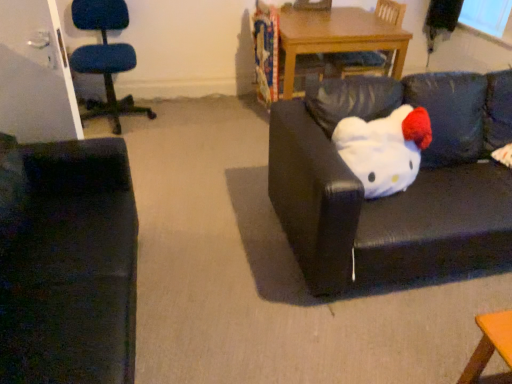
In order to face black leather couch at center, which ranks as the first studio couch in right-to-left order, should I rotate leftwards or rightwards?

You should rotate right by 24.786 degrees.

How much space does black leather couch at center, which ranks as the first studio couch in right-to-left order, occupy horizontally?

It is 33.76 inches.

What is the approximate width of white plush toy at right?

10.92 inches.

What do you see at coordinates (105, 57) in the screenshot? I see `blue fabric chair at left, positioned as the first chair in left-to-right order` at bounding box center [105, 57].

Image resolution: width=512 pixels, height=384 pixels. Find the location of `wooden chair at upper center, which appears as the second chair when viewed from the left`. wooden chair at upper center, which appears as the second chair when viewed from the left is located at coordinates 362,62.

In the image, is wooden chair at upper center, which appears as the second chair when viewed from the left, positioned in front of or behind wooden table at center?

wooden chair at upper center, which appears as the second chair when viewed from the left, is behind wooden table at center.

Is wooden chair at upper center, which appears as the second chair when viewed from the left, smaller than wooden table at center?

Correct, wooden chair at upper center, which appears as the second chair when viewed from the left, occupies less space than wooden table at center.

Is wooden chair at upper center, which appears as the second chair when viewed from the left, looking in the opposite direction of wooden table at center?

Yes, wooden chair at upper center, which appears as the second chair when viewed from the left, is facing away from wooden table at center.

Could you tell me if wooden chair at upper center, which appears as the second chair when viewed from the left, is turned towards blue fabric chair at left, arranged as the 2th chair when viewed from the right?

Yes, wooden chair at upper center, which appears as the second chair when viewed from the left, is facing blue fabric chair at left, arranged as the 2th chair when viewed from the right.

Is blue fabric chair at left, positioned as the first chair in left-to-right order, surrounded by wooden chair at upper center, the first chair from the right?

Actually, blue fabric chair at left, positioned as the first chair in left-to-right order, is outside wooden chair at upper center, the first chair from the right.

Are wooden chair at upper center, the first chair from the right, and blue fabric chair at left, arranged as the 2th chair when viewed from the right, located far from each other?

Yes, wooden chair at upper center, the first chair from the right, and blue fabric chair at left, arranged as the 2th chair when viewed from the right, are quite far apart.

Is wooden chair at upper center, the first chair from the right, taller or shorter than blue fabric chair at left, arranged as the 2th chair when viewed from the right?

wooden chair at upper center, the first chair from the right, is shorter than blue fabric chair at left, arranged as the 2th chair when viewed from the right.

Based on the photo, in terms of height, does wooden chair at upper center, which appears as the second chair when viewed from the left, look taller or shorter compared to white plush toy at right?

wooden chair at upper center, which appears as the second chair when viewed from the left, is taller than white plush toy at right.

This screenshot has width=512, height=384. Find the location of `toy above the wooden chair at upper center, which appears as the second chair when viewed from the left (from a real-world perspective)`. toy above the wooden chair at upper center, which appears as the second chair when viewed from the left (from a real-world perspective) is located at coordinates (384, 149).

Is wooden chair at upper center, which appears as the second chair when viewed from the left, oriented away from white plush toy at right?

No, wooden chair at upper center, which appears as the second chair when viewed from the left, is not facing away from white plush toy at right.

Which object is closer to the camera taking this photo, wooden chair at upper center, the first chair from the right, or white plush toy at right?

white plush toy at right is closer to the camera.

Looking at this image, is blue fabric chair at left, arranged as the 2th chair when viewed from the right, not inside black leather couch at center, arranged as the 2th studio couch when viewed from the left?

Indeed, blue fabric chair at left, arranged as the 2th chair when viewed from the right, is completely outside black leather couch at center, arranged as the 2th studio couch when viewed from the left.

Considering the sizes of objects blue fabric chair at left, arranged as the 2th chair when viewed from the right, and black leather couch at center, arranged as the 2th studio couch when viewed from the left, in the image provided, who is smaller, blue fabric chair at left, arranged as the 2th chair when viewed from the right, or black leather couch at center, arranged as the 2th studio couch when viewed from the left,?

With smaller size is blue fabric chair at left, arranged as the 2th chair when viewed from the right.

Is blue fabric chair at left, arranged as the 2th chair when viewed from the right, far away from black leather couch at center, arranged as the 2th studio couch when viewed from the left?

Yes, blue fabric chair at left, arranged as the 2th chair when viewed from the right, is far from black leather couch at center, arranged as the 2th studio couch when viewed from the left.

Is point (429, 144) farther from viewer compared to point (344, 286)?

Yes, point (429, 144) is behind point (344, 286).

Considering the positions of objects white plush toy at right and black leather couch at center, which ranks as the first studio couch in right-to-left order, in the image provided, who is more to the left, white plush toy at right or black leather couch at center, which ranks as the first studio couch in right-to-left order,?

From the viewer's perspective, white plush toy at right appears more on the left side.

From the image's perspective, is white plush toy at right located above black leather couch at center, arranged as the 2th studio couch when viewed from the left?

Yes, from the image's perspective, white plush toy at right is on top of black leather couch at center, arranged as the 2th studio couch when viewed from the left.

Is white plush toy at right oriented towards black leather couch at center, arranged as the 2th studio couch when viewed from the left?

Yes, white plush toy at right is turned towards black leather couch at center, arranged as the 2th studio couch when viewed from the left.

Is point (381, 126) closer or farther from the camera than point (316, 18)?

Clearly, point (381, 126) is closer to the camera than point (316, 18).

Looking at the image, does white plush toy at right seem bigger or smaller compared to wooden table at center?

Considering their sizes, white plush toy at right takes up less space than wooden table at center.

Between white plush toy at right and wooden table at center, which one appears on the right side from the viewer's perspective?

From the viewer's perspective, white plush toy at right appears more on the right side.

From the image's perspective, is wooden chair at upper center, which appears as the second chair when viewed from the left, under black leather couch at center, which ranks as the first studio couch in right-to-left order?

No, from the image's perspective, wooden chair at upper center, which appears as the second chair when viewed from the left, is not below black leather couch at center, which ranks as the first studio couch in right-to-left order.

Is wooden chair at upper center, which appears as the second chair when viewed from the left, oriented towards black leather couch at center, arranged as the 2th studio couch when viewed from the left?

No, wooden chair at upper center, which appears as the second chair when viewed from the left, does not turn towards black leather couch at center, arranged as the 2th studio couch when viewed from the left.

Is wooden chair at upper center, which appears as the second chair when viewed from the left, to the left of black leather couch at center, which ranks as the first studio couch in right-to-left order, from the viewer's perspective?

Indeed, wooden chair at upper center, which appears as the second chair when viewed from the left, is positioned on the left side of black leather couch at center, which ranks as the first studio couch in right-to-left order.

Is wooden chair at upper center, which appears as the second chair when viewed from the left, not inside black leather couch at center, which ranks as the first studio couch in right-to-left order?

Indeed, wooden chair at upper center, which appears as the second chair when viewed from the left, is completely outside black leather couch at center, which ranks as the first studio couch in right-to-left order.

Where is `table below the wooden chair at upper center, the first chair from the right (from the image's perspective)`? table below the wooden chair at upper center, the first chair from the right (from the image's perspective) is located at coordinates click(x=337, y=37).

You are a GUI agent. You are given a task and a screenshot of the screen. Output one action in this format:
    pyautogui.click(x=<x>, y=<y>)
    Task: Click on the chair below the wooden chair at upper center, the first chair from the right (from a real-world perspective)
    
    Given the screenshot: What is the action you would take?
    pyautogui.click(x=105, y=57)

Considering their positions, is white plush toy at right positioned further to velvet dark green couch at left, which appears as the 2th studio couch when viewed from the right, than blue fabric chair at left, arranged as the 2th chair when viewed from the right?

blue fabric chair at left, arranged as the 2th chair when viewed from the right, is further to velvet dark green couch at left, which appears as the 2th studio couch when viewed from the right.

Estimate the real-world distances between objects in this image. Which object is further from wooden chair at upper center, which appears as the second chair when viewed from the left, wooden table at center or blue fabric chair at left, arranged as the 2th chair when viewed from the right?

The object further to wooden chair at upper center, which appears as the second chair when viewed from the left, is blue fabric chair at left, arranged as the 2th chair when viewed from the right.

When comparing their distances from blue fabric chair at left, arranged as the 2th chair when viewed from the right, does wooden chair at upper center, the first chair from the right, or wooden table at center seem further?

The object further to blue fabric chair at left, arranged as the 2th chair when viewed from the right, is wooden chair at upper center, the first chair from the right.

Which object lies further to the anchor point wooden chair at upper center, the first chair from the right, black leather couch at center, which ranks as the first studio couch in right-to-left order, or white plush toy at right?

Based on the image, white plush toy at right appears to be further to wooden chair at upper center, the first chair from the right.

Which object lies further to the anchor point wooden table at center, velvet dark green couch at left, marked as the first studio couch in a left-to-right arrangement, or black leather couch at center, arranged as the 2th studio couch when viewed from the left?

velvet dark green couch at left, marked as the first studio couch in a left-to-right arrangement.

Which object lies nearer to the anchor point white plush toy at right, velvet dark green couch at left, marked as the first studio couch in a left-to-right arrangement, or wooden chair at upper center, the first chair from the right?

Based on the image, velvet dark green couch at left, marked as the first studio couch in a left-to-right arrangement, appears to be nearer to white plush toy at right.

Estimate the real-world distances between objects in this image. Which object is closer to black leather couch at center, arranged as the 2th studio couch when viewed from the left, wooden table at center or blue fabric chair at left, positioned as the first chair in left-to-right order?

wooden table at center is positioned closer to the anchor black leather couch at center, arranged as the 2th studio couch when viewed from the left.

When comparing their distances from white plush toy at right, does black leather couch at center, arranged as the 2th studio couch when viewed from the left, or wooden table at center seem closer?

black leather couch at center, arranged as the 2th studio couch when viewed from the left, is closer to white plush toy at right.

At what (x,y) coordinates should I click in order to perform the action: click on toy positioned between velvet dark green couch at left, marked as the first studio couch in a left-to-right arrangement, and wooden chair at upper center, the first chair from the right, from near to far. Please return your answer as a coordinate pair (x, y). The width and height of the screenshot is (512, 384). Looking at the image, I should click on (384, 149).

Locate an element on the screen. The image size is (512, 384). toy between velvet dark green couch at left, marked as the first studio couch in a left-to-right arrangement, and black leather couch at center, arranged as the 2th studio couch when viewed from the left is located at coordinates (384, 149).

The image size is (512, 384). Find the location of `studio couch between velvet dark green couch at left, marked as the first studio couch in a left-to-right arrangement, and wooden chair at upper center, the first chair from the right, in the front-back direction`. studio couch between velvet dark green couch at left, marked as the first studio couch in a left-to-right arrangement, and wooden chair at upper center, the first chair from the right, in the front-back direction is located at coordinates (399, 193).

Locate an element on the screen. This screenshot has height=384, width=512. table between white plush toy at right and wooden chair at upper center, which appears as the second chair when viewed from the left, from front to back is located at coordinates (337, 37).